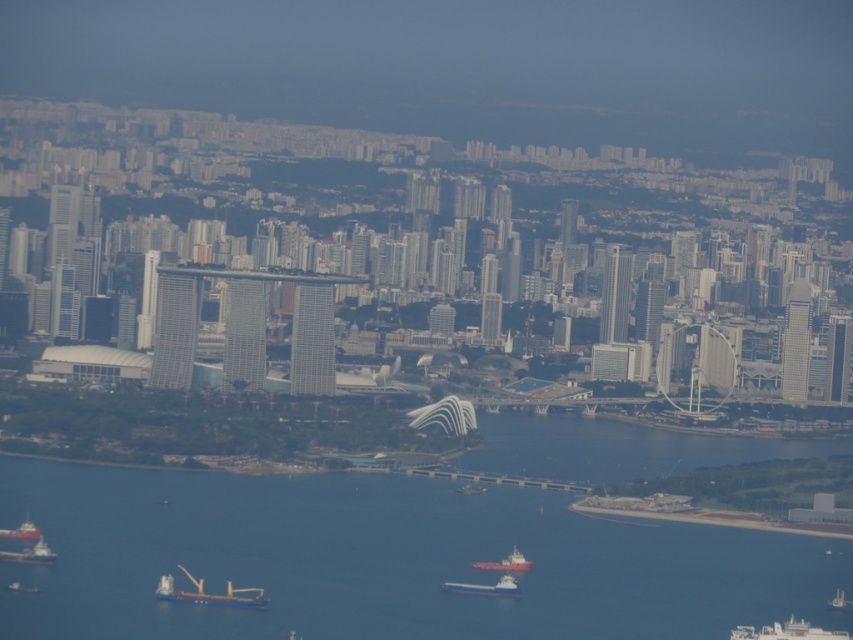
Based on the scene description, where is the metallic blue ship at center located in the image coordinates?

The metallic blue ship at center is located at point coordinates of (486,588).

Consider the image. You are a drone operator tasked with capturing aerial footage of the city. You notice the white matte boat at lower right and the metallic blue ship at center. Which object should you adjust your camera angle to focus on if you want to capture the taller structure?

The white matte boat at lower right is much taller than the metallic blue ship at center, so you should focus your camera angle on the white matte boat at lower right to capture the taller structure.

You are a delivery drone flying above the city and need to land on the blue metallic cargo ship at lower left. The coordinates for landing are given as point (209, 593). Is this point on the correct ship?

Yes, the point (209, 593) is on the blue metallic cargo ship at lower left, so the drone can land there safely.